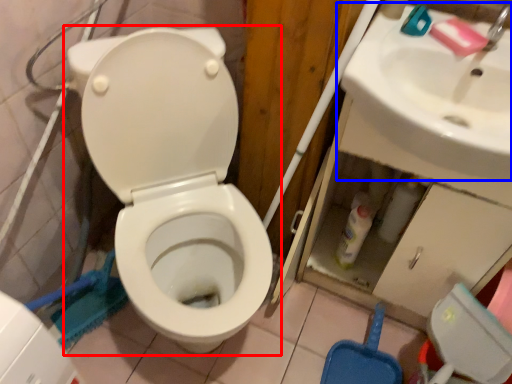
Question: Which object is closer to the camera taking this photo, toilet (highlighted by a red box) or sink (highlighted by a blue box)?

Choices:
 (A) toilet
 (B) sink

Answer: (A)